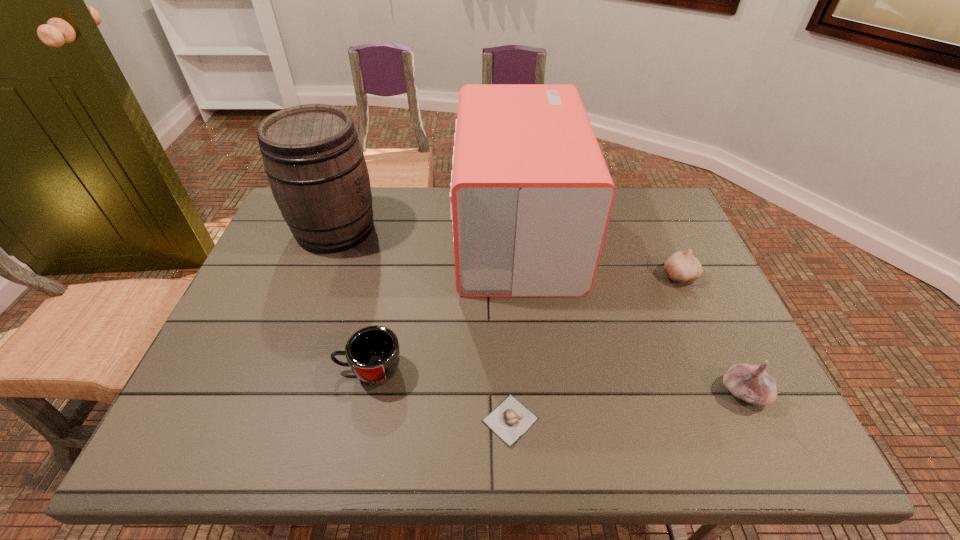
Image resolution: width=960 pixels, height=540 pixels. What are the coordinates of `object at the left edge` in the screenshot? It's located at (315, 164).

Where is `object at the far left corner`? The width and height of the screenshot is (960, 540). object at the far left corner is located at coordinates (315, 164).

This screenshot has width=960, height=540. What are the coordinates of `free point at the far edge` in the screenshot? It's located at (408, 207).

Find the location of a particular element. This screenshot has height=540, width=960. free space at the near edge of the desktop is located at coordinates (338, 418).

At what (x,y) coordinates should I click in order to perform the action: click on free space at the left edge of the desktop. Please return your answer as a coordinate pair (x, y). Looking at the image, I should click on (317, 255).

This screenshot has width=960, height=540. I want to click on free space at the far right corner of the desktop, so click(x=635, y=198).

Where is `vacant region between the shortest object and the tallest garlic`? vacant region between the shortest object and the tallest garlic is located at coordinates (627, 406).

This screenshot has width=960, height=540. I want to click on vacant area that lies between the farthest garlic and the mug, so click(x=524, y=322).

This screenshot has height=540, width=960. Identify the location of vacant space that is in between the wine bucket and the mug. (352, 299).

Locate an element on the screen. The image size is (960, 540). free spot between the leftmost garlic and the wine bucket is located at coordinates (423, 324).